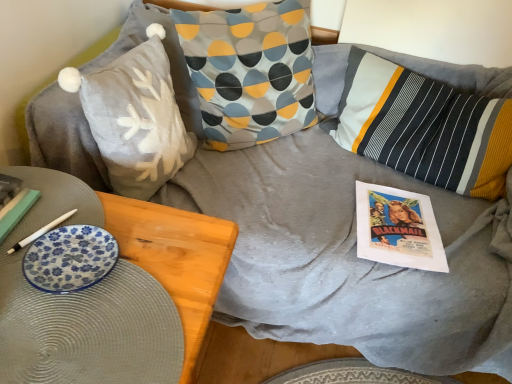
Question: Is matte paper comic book at center right taller than striped cotton pillow at center, marked as the 1th pillow in a right-to-left arrangement?

Choices:
 (A) yes
 (B) no

Answer: (B)

Question: From the image's perspective, is matte paper comic book at center right on striped cotton pillow at center, marked as the 1th pillow in a right-to-left arrangement?

Choices:
 (A) yes
 (B) no

Answer: (B)

Question: Does matte paper comic book at center right come in front of striped cotton pillow at center, the third pillow viewed from the left?

Choices:
 (A) no
 (B) yes

Answer: (A)

Question: Is matte paper comic book at center right not within striped cotton pillow at center, the third pillow viewed from the left?

Choices:
 (A) yes
 (B) no

Answer: (A)

Question: Considering the relative sizes of matte paper comic book at center right and striped cotton pillow at center, the third pillow viewed from the left, in the image provided, is matte paper comic book at center right smaller than striped cotton pillow at center, the third pillow viewed from the left,?

Choices:
 (A) no
 (B) yes

Answer: (B)

Question: From a real-world perspective, is matte paper comic book at center right positioned over striped cotton pillow at center, marked as the 1th pillow in a right-to-left arrangement, based on gravity?

Choices:
 (A) yes
 (B) no

Answer: (B)

Question: Does fuzzy gray pillow with white snowflake at upper left, placed as the first pillow when sorted from left to right, come in front of blue floral plate at lower left?

Choices:
 (A) no
 (B) yes

Answer: (A)

Question: From the image's perspective, would you say fuzzy gray pillow with white snowflake at upper left, placed as the first pillow when sorted from left to right, is shown under blue floral plate at lower left?

Choices:
 (A) yes
 (B) no

Answer: (B)

Question: Is fuzzy gray pillow with white snowflake at upper left, placed as the first pillow when sorted from left to right, completely or partially outside of blue floral plate at lower left?

Choices:
 (A) yes
 (B) no

Answer: (A)

Question: From a real-world perspective, does fuzzy gray pillow with white snowflake at upper left, acting as the 3th pillow starting from the right, sit lower than blue floral plate at lower left?

Choices:
 (A) yes
 (B) no

Answer: (A)

Question: Is fuzzy gray pillow with white snowflake at upper left, acting as the 3th pillow starting from the right, turned away from blue floral plate at lower left?

Choices:
 (A) yes
 (B) no

Answer: (B)

Question: Can you confirm if fuzzy gray pillow with white snowflake at upper left, acting as the 3th pillow starting from the right, is shorter than blue floral plate at lower left?

Choices:
 (A) yes
 (B) no

Answer: (B)

Question: Is blue floral plate at lower left outside striped cotton pillow at center, the third pillow viewed from the left?

Choices:
 (A) yes
 (B) no

Answer: (A)